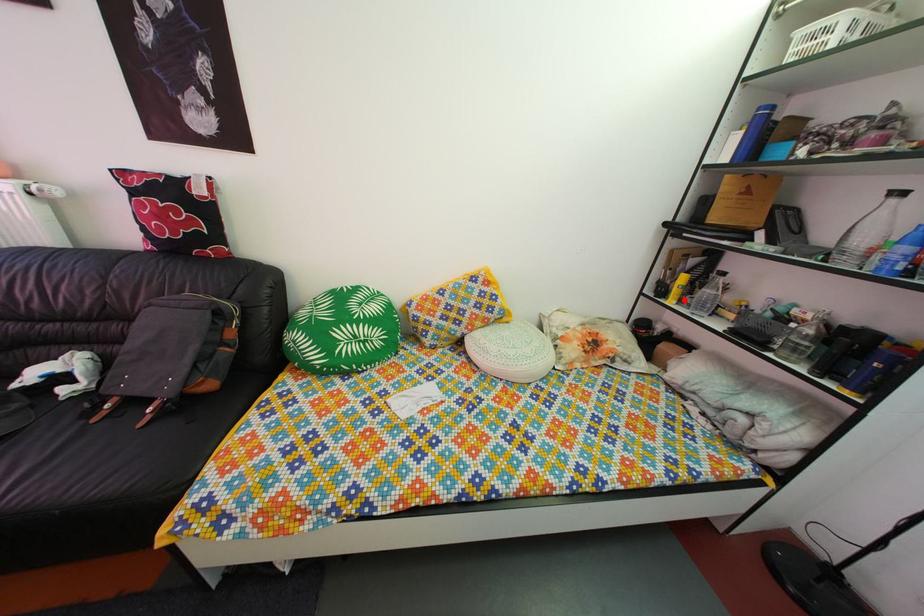
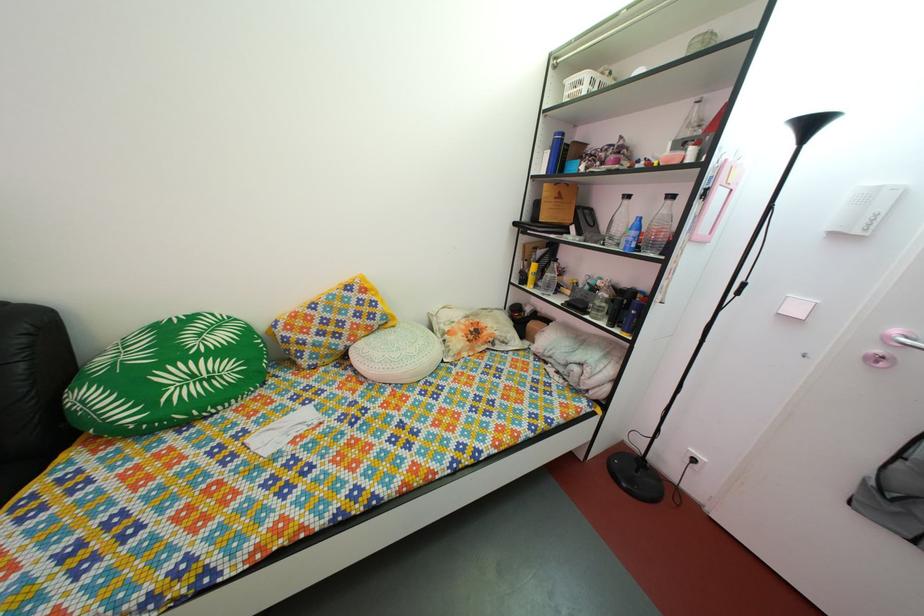
In the second image, find the point that corresponds to the highlighted location in the first image.

(540, 286)